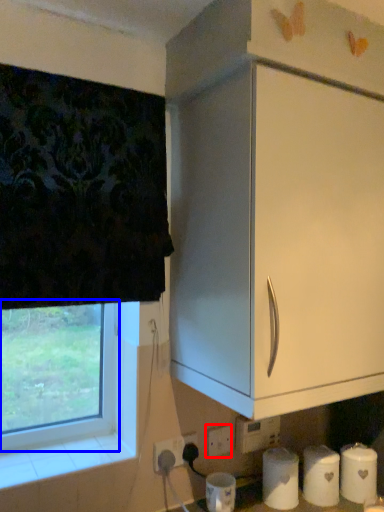
Question: Which object appears farthest to the camera in this image, electric outlet (highlighted by a red box) or window (highlighted by a blue box)?

Choices:
 (A) electric outlet
 (B) window

Answer: (A)